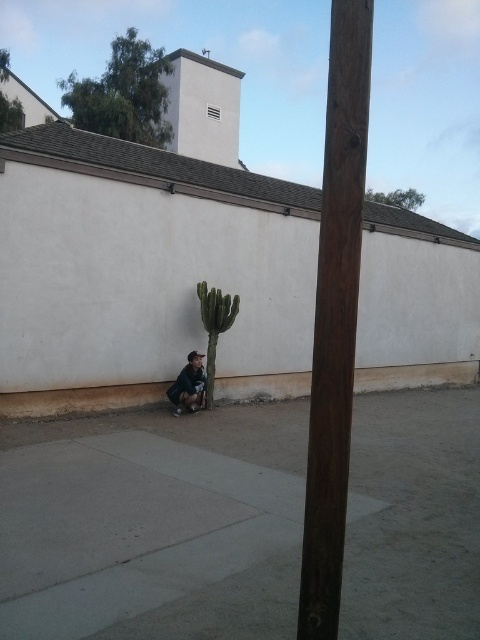
You are a gardener trying to plant a new cactus. You see the gray concrete pavement at lower center and the green spiky cactus at lower center. Which surface is wider for placing the new cactus?

The gray concrete pavement at lower center is wider than the green spiky cactus at lower center, so it would be a better surface for placing the new cactus.

In the scene shown: You are a gardener trying to water the green spiky cactus at lower center. You notice the gray concrete pavement at lower center nearby. Which object takes up more space in the scene?

The green spiky cactus at lower center takes up more space in the scene than the gray concrete pavement at lower center because the pavement is smaller in size according to the description.

You are a gardener who needs to place a new decorative rock next to the brown concrete curb at lower left and the green spiky cactus at lower center. Which object should you place the rock closer to if you want it to be near the larger one?

The brown concrete curb at lower left is bigger than the green spiky cactus at lower center, so you should place the rock closer to the brown concrete curb at lower left.